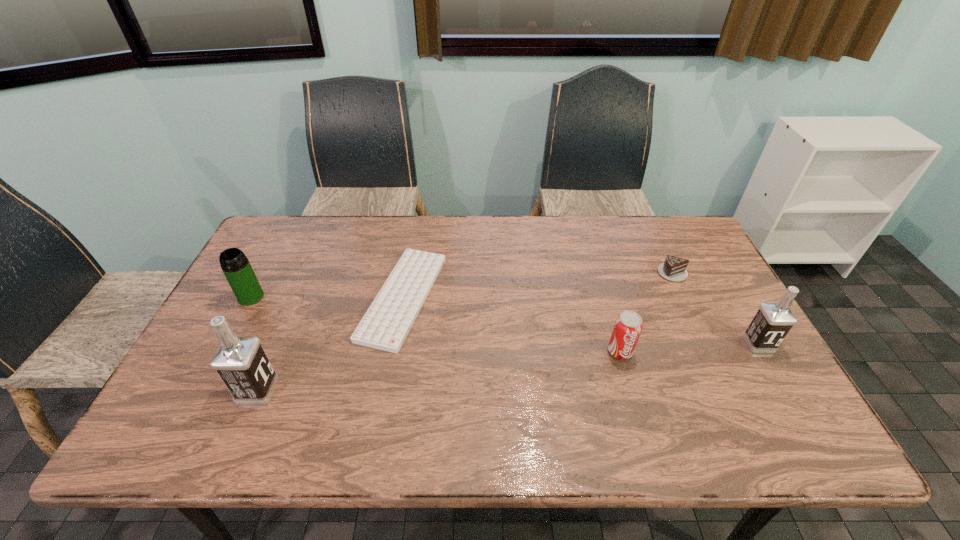
Identify the location of vodka that is positioned at the right edge. The height and width of the screenshot is (540, 960). (772, 322).

In order to click on chocolate cake located at the right edge in this screenshot , I will do `click(674, 269)`.

Where is `object situated at the near left corner`? This screenshot has width=960, height=540. object situated at the near left corner is located at coordinates (240, 361).

In the image, there is a desktop. At what (x,y) coordinates should I click in order to perform the action: click on vacant area at the far edge. Please return your answer as a coordinate pair (x, y). Looking at the image, I should click on (606, 219).

This screenshot has width=960, height=540. In order to click on free space at the near edge in this screenshot , I will do `click(404, 393)`.

The width and height of the screenshot is (960, 540). I want to click on vacant space at the far left corner, so click(313, 228).

This screenshot has height=540, width=960. In the image, there is a desktop. Identify the location of vacant space at the far right corner. (672, 222).

Where is `free space between the fourth object from left to right and the thermos bottle`? This screenshot has width=960, height=540. free space between the fourth object from left to right and the thermos bottle is located at coordinates (436, 324).

The width and height of the screenshot is (960, 540). What are the coordinates of `unoccupied area between the fifth object from left to right and the third object from left to right` in the screenshot? It's located at (538, 285).

Identify the location of free spot between the shortest object and the third shortest object. (512, 324).